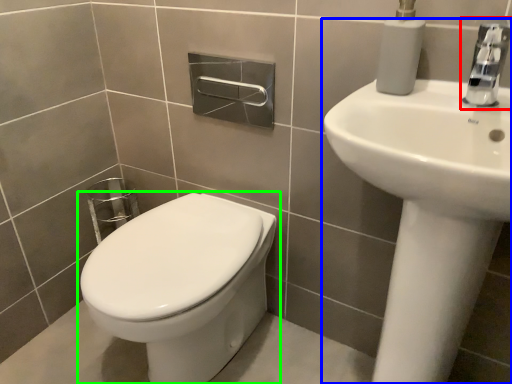
Question: Based on their relative distances, which object is farther from tap (highlighted by a red box)? Choose from sink (highlighted by a blue box) and toilet (highlighted by a green box).

Choices:
 (A) sink
 (B) toilet

Answer: (B)